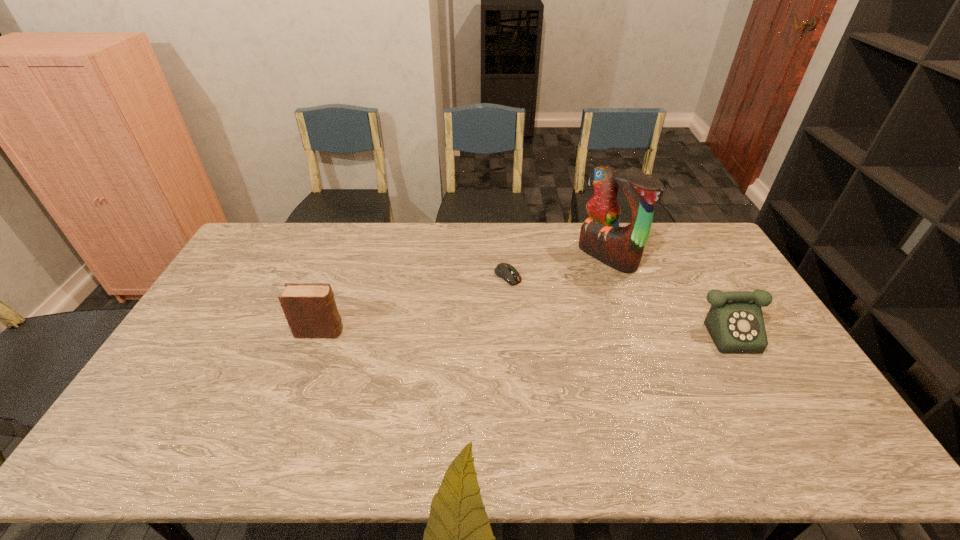
Find the location of `vacant space located 0.260m on the button of the third object from right to left`. vacant space located 0.260m on the button of the third object from right to left is located at coordinates (569, 333).

Locate an element on the screen. vacant area situated on the button of the third object from right to left is located at coordinates pos(590,353).

Locate an element on the screen. vacant space situated 0.050m on the button of the third object from right to left is located at coordinates (525, 293).

Locate an element on the screen. This screenshot has height=540, width=960. free region located 0.190m at the face of the third object from left to right is located at coordinates (551, 291).

Where is `vacant space situated 0.400m at the face of the third object from left to right`? vacant space situated 0.400m at the face of the third object from left to right is located at coordinates (503, 320).

Where is `vacant area located 0.330m at the face of the third object from left to right`? vacant area located 0.330m at the face of the third object from left to right is located at coordinates (519, 309).

The width and height of the screenshot is (960, 540). What are the coordinates of `object that is at the far edge` in the screenshot? It's located at (621, 248).

Identify the location of object at the right edge. The width and height of the screenshot is (960, 540). (735, 322).

Where is `vacant space at the far edge of the desktop`? The height and width of the screenshot is (540, 960). vacant space at the far edge of the desktop is located at coordinates (523, 234).

Where is `blank space at the near edge of the desktop`? This screenshot has width=960, height=540. blank space at the near edge of the desktop is located at coordinates coord(525,410).